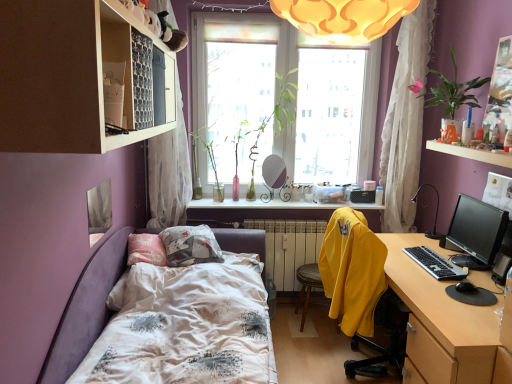
The width and height of the screenshot is (512, 384). I want to click on free point below black glossy monitor at right (from a real-world perspective), so click(x=465, y=258).